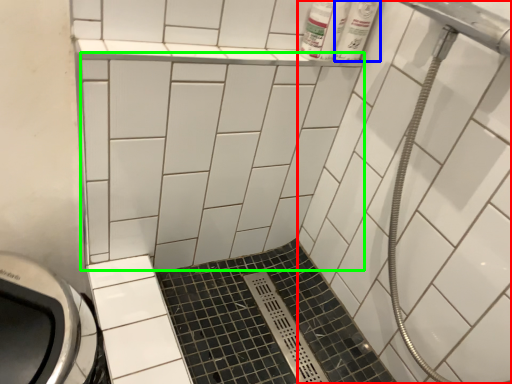
Question: Which object is the farthest from bath (highlighted by a red box)? Choose among these: toiletry (highlighted by a blue box) or ceramic tile (highlighted by a green box).

Choices:
 (A) toiletry
 (B) ceramic tile

Answer: (A)